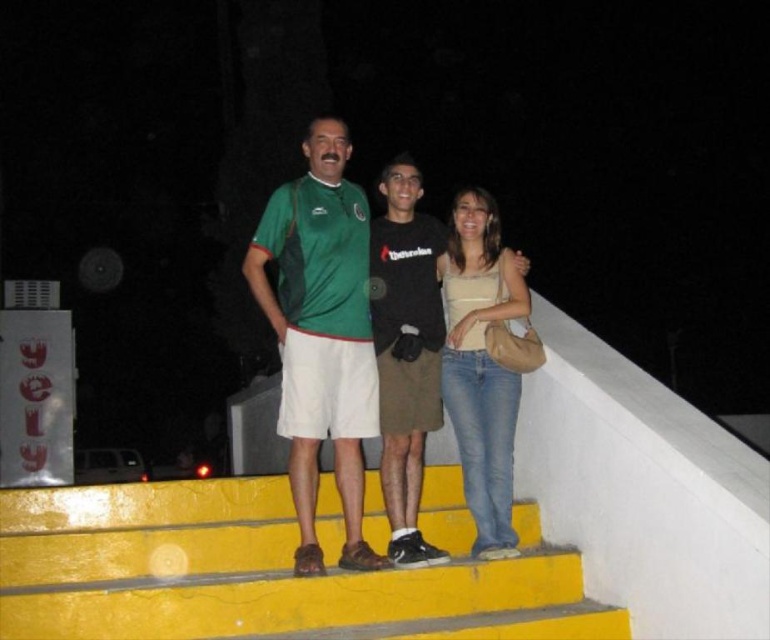
Is black cotton shirt at center to the left of denim jeans at center from the viewer's perspective?

→ Yes, black cotton shirt at center is to the left of denim jeans at center.

Is point (417, 550) closer to viewer compared to point (464, 412)?

Yes, it is in front of point (464, 412).

The height and width of the screenshot is (640, 770). Find the location of `black cotton shirt at center`. black cotton shirt at center is located at coordinates (404, 349).

Between green fabric shirt at center and denim jeans at center, which one is positioned higher?

green fabric shirt at center

Is point (283, 339) behind point (474, 259)?

No, (283, 339) is in front of (474, 259).

You are a GUI agent. You are given a task and a screenshot of the screen. Output one action in this format:
    pyautogui.click(x=<x>, y=<y>)
    Task: Click on the green fabric shirt at center
    The image size is (770, 640).
    Given the screenshot: What is the action you would take?
    pyautogui.click(x=320, y=333)

Is point (387, 586) positioned in front of point (365, 276)?

Yes, it is.

Does yellow painted stairs at center have a lesser width compared to green fabric shirt at center?

No, yellow painted stairs at center is not thinner than green fabric shirt at center.

Find the location of a particular element. yellow painted stairs at center is located at coordinates (265, 570).

This screenshot has height=640, width=770. What are the coordinates of `yellow painted stairs at center` in the screenshot? It's located at (265, 570).